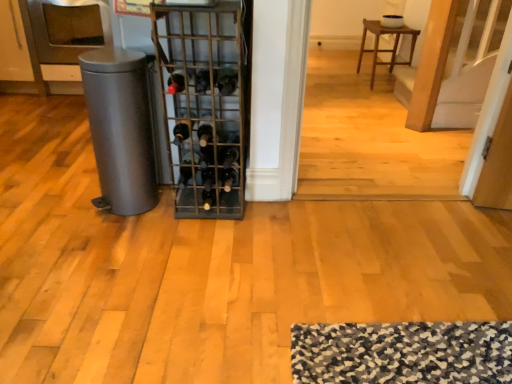
Question: Considering the positions of black glass wine bottle at center, marked as the 5th wine bottle in a left-to-right arrangement, and brown wooden stool at upper center in the image, is black glass wine bottle at center, marked as the 5th wine bottle in a left-to-right arrangement, bigger or smaller than brown wooden stool at upper center?

Choices:
 (A) big
 (B) small

Answer: (B)

Question: Choose the correct answer: Is black glass wine bottle at center, which is counted as the 2th wine bottle, starting from the right, inside brown wooden stool at upper center or outside it?

Choices:
 (A) inside
 (B) outside

Answer: (B)

Question: Which object is positioned farthest from the matte gray trash can at left?

Choices:
 (A) shiny dark red wine bottle at center, which is the 2th wine bottle in left-to-right order
 (B) black glass wine bottle at center, which is the 3th wine bottle from right to left
 (C) black glass wine bottle at center, the 6th wine bottle from the right
 (D) black glass wine bottle at center, marked as the 5th wine bottle in a left-to-right arrangement
 (E) black glass wine bottle at center, placed as the 6th wine bottle when sorted from left to right

Answer: (D)

Question: Based on their relative distances, which object is nearer to the metallic wire wine rack at center?

Choices:
 (A) brown wooden stool at upper center
 (B) black glass wine bottle at center, acting as the fourth wine bottle starting from the left
 (C) black glass wine bottle at center, which appears as the third wine bottle when viewed from the left
 (D) shiny dark red wine bottle at center, which is the 2th wine bottle in left-to-right order
 (E) black glass wine bottle at center, which is counted as the 2th wine bottle, starting from the right

Answer: (B)